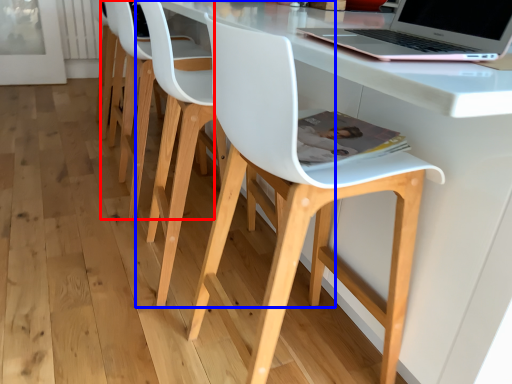
Question: Which of the following is the farthest to the observer, chair (highlighted by a red box) or chair (highlighted by a blue box)?

Choices:
 (A) chair
 (B) chair

Answer: (A)